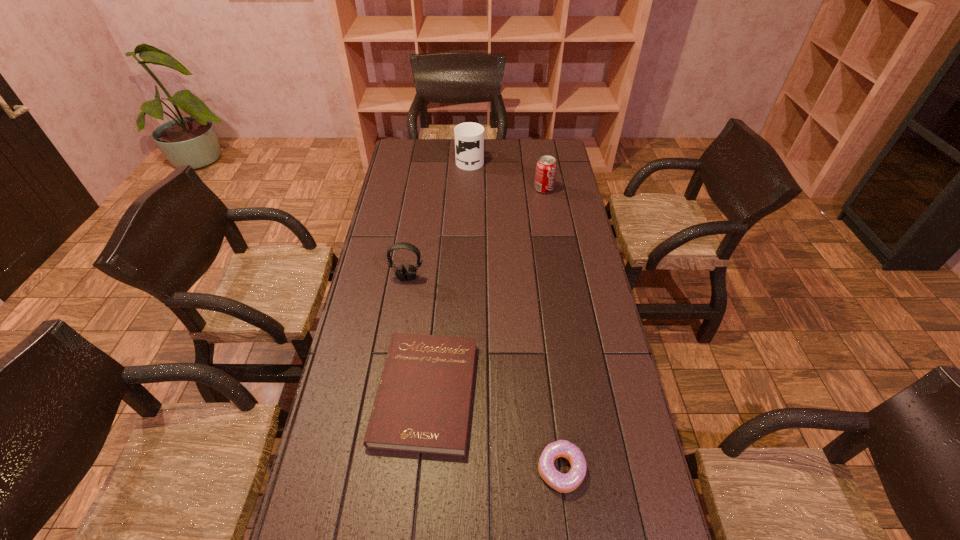
The width and height of the screenshot is (960, 540). Find the location of `object located in the far edge section of the desktop`. object located in the far edge section of the desktop is located at coordinates (469, 137).

Where is `headset that is at the left edge`? headset that is at the left edge is located at coordinates (401, 273).

Locate an element on the screen. This screenshot has width=960, height=540. hardback book at the left edge is located at coordinates (422, 404).

I want to click on soda that is at the right edge, so click(x=546, y=167).

You are a GUI agent. You are given a task and a screenshot of the screen. Output one action in this format:
    pyautogui.click(x=<x>, y=<y>)
    Task: Click on the doughnut at the right edge
    The width and height of the screenshot is (960, 540).
    Given the screenshot: What is the action you would take?
    pyautogui.click(x=564, y=483)

You are a GUI agent. You are given a task and a screenshot of the screen. Output one action in this format:
    pyautogui.click(x=<x>, y=<y>)
    Task: Click on the free region at the far edge
    This screenshot has height=540, width=960.
    Given the screenshot: What is the action you would take?
    pyautogui.click(x=490, y=152)

You are a GUI agent. You are given a task and a screenshot of the screen. Output one action in this format:
    pyautogui.click(x=<x>, y=<y>)
    Task: Click on the free space at the left edge of the desktop
    
    Given the screenshot: What is the action you would take?
    point(412,174)

In the image, there is a desktop. Identify the location of vacant space at the right edge. (566, 306).

In the image, there is a desktop. In order to click on vacant space at the far right corner in this screenshot , I will do `click(549, 139)`.

Image resolution: width=960 pixels, height=540 pixels. I want to click on free area in between the farthest object and the second farthest object, so click(x=507, y=174).